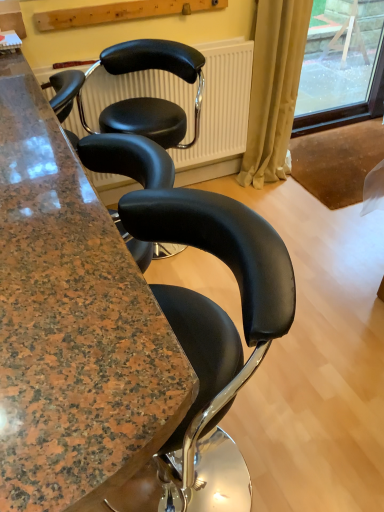
What do you see at coordinates (138, 97) in the screenshot? I see `black leather chair at center` at bounding box center [138, 97].

Locate an element on the screen. This screenshot has height=512, width=384. black leather chair at center is located at coordinates (x=138, y=97).

The height and width of the screenshot is (512, 384). In order to click on granite countertop at center in this screenshot , I will do `click(72, 325)`.

In order to face granite countertop at center, should I rotate leftwards or rightwards?

A 21.660 degree turn to the left will do.

The image size is (384, 512). I want to click on beige fabric curtain at right, so click(x=274, y=88).

Locate an element on the screen. This screenshot has width=384, height=512. transparent glass window at upper right is located at coordinates (339, 54).

Is black leather chair at center directly adjacent to granite countertop at center?

black leather chair at center and granite countertop at center are clearly separated.

Consider the image. Does black leather chair at center have a lesser height compared to granite countertop at center?

Yes, black leather chair at center is shorter than granite countertop at center.

Which is more to the left, black leather chair at center or granite countertop at center?

granite countertop at center.

Is black leather chair at center positioned in front of granite countertop at center?

No.

Is transparent glass window at upper right positioned in front of beige fabric curtain at right?

No, transparent glass window at upper right is behind beige fabric curtain at right.

From the picture: Is there a large distance between transparent glass window at upper right and beige fabric curtain at right?

That's not correct — transparent glass window at upper right is a little close to beige fabric curtain at right.

How distant is transparent glass window at upper right from beige fabric curtain at right?

transparent glass window at upper right and beige fabric curtain at right are 89.48 centimeters apart from each other.

Between point (341, 85) and point (295, 81), which one is positioned in front?

The point (295, 81) is in front.

How many degrees apart are the facing directions of granite countertop at center and black leather chair at center?

The angle between the facing direction of granite countertop at center and the facing direction of black leather chair at center is 0.332 degrees.

Is granite countertop at center taller than black leather chair at center?

Correct, granite countertop at center is much taller as black leather chair at center.

Considering the sizes of granite countertop at center and black leather chair at center in the image, is granite countertop at center bigger or smaller than black leather chair at center?

Result: granite countertop at center is bigger than black leather chair at center.

Is transparent glass window at upper right wider than black leather chair at center?

No, transparent glass window at upper right is not wider than black leather chair at center.

Does point (360, 90) appear closer or farther from the camera than point (189, 61)?

Point (360, 90) appears to be farther away from the viewer than point (189, 61).

Is transparent glass window at upper right inside the boundaries of black leather chair at center, or outside?

transparent glass window at upper right exists outside the volume of black leather chair at center.

Where is `window screen behind the black leather chair at center`? window screen behind the black leather chair at center is located at coordinates (339, 54).

Which is more to the right, granite countertop at center or transparent glass window at upper right?

transparent glass window at upper right is more to the right.

What are the coordinates of `cabinetry that is under the transparent glass window at upper right (from a real-world perspective)` in the screenshot? It's located at (72, 325).

Considering the sizes of objects granite countertop at center and transparent glass window at upper right in the image provided, who is thinner, granite countertop at center or transparent glass window at upper right?

transparent glass window at upper right.

Measure the distance from granite countertop at center to transparent glass window at upper right.

granite countertop at center and transparent glass window at upper right are 8.10 feet apart.

Would you consider granite countertop at center to be distant from beige fabric curtain at right?

granite countertop at center is far away from beige fabric curtain at right.

Does point (119, 277) come closer to viewer compared to point (290, 12)?

Yes, it is in front of point (290, 12).

Can you confirm if granite countertop at center is positioned to the left of beige fabric curtain at right?

Indeed, granite countertop at center is positioned on the left side of beige fabric curtain at right.

From the image's perspective, is granite countertop at center beneath beige fabric curtain at right?

Yes, from the image's perspective, granite countertop at center is below beige fabric curtain at right.

Looking at this image, visually, is beige fabric curtain at right positioned to the left or to the right of black leather chair at center?

From the image, it's evident that beige fabric curtain at right is to the right of black leather chair at center.

Can you confirm if beige fabric curtain at right is shorter than black leather chair at center?

No.

How many degrees apart are the facing directions of beige fabric curtain at right and black leather chair at center?

beige fabric curtain at right and black leather chair at center are facing 91.2 degrees away from each other.

Which of these two, beige fabric curtain at right or black leather chair at center, is smaller?

beige fabric curtain at right.

I want to click on cabinetry below the black leather chair at center (from the image's perspective), so click(72, 325).

Identify the location of curtain lying in front of the transparent glass window at upper right. (274, 88).

Considering their positions, is transparent glass window at upper right positioned closer to beige fabric curtain at right than granite countertop at center?

Among the two, transparent glass window at upper right is located nearer to beige fabric curtain at right.

When comparing their distances from beige fabric curtain at right, does black leather chair at center or granite countertop at center seem closer?

The object closer to beige fabric curtain at right is black leather chair at center.

Estimate the real-world distances between objects in this image. Which object is closer to transparent glass window at upper right, granite countertop at center or beige fabric curtain at right?

beige fabric curtain at right is positioned closer to the anchor transparent glass window at upper right.

Based on their spatial positions, is beige fabric curtain at right or black leather chair at center closer to granite countertop at center?

Among the two, black leather chair at center is located nearer to granite countertop at center.

When comparing their distances from granite countertop at center, does transparent glass window at upper right or black leather chair at center seem closer?

Based on the image, black leather chair at center appears to be nearer to granite countertop at center.

Looking at the image, which one is located further to black leather chair at center, granite countertop at center or transparent glass window at upper right?

Based on the image, transparent glass window at upper right appears to be further to black leather chair at center.

Based on their spatial positions, is granite countertop at center or transparent glass window at upper right closer to beige fabric curtain at right?

Among the two, transparent glass window at upper right is located nearer to beige fabric curtain at right.

Which object lies further to the anchor point transparent glass window at upper right, beige fabric curtain at right or black leather chair at center?

The object further to transparent glass window at upper right is black leather chair at center.

Where is `chair between granite countertop at center and transparent glass window at upper right from front to back`? chair between granite countertop at center and transparent glass window at upper right from front to back is located at coordinates (138, 97).

Image resolution: width=384 pixels, height=512 pixels. I want to click on curtain positioned between granite countertop at center and transparent glass window at upper right from near to far, so click(x=274, y=88).

Locate an element on the screen. The height and width of the screenshot is (512, 384). curtain located between black leather chair at center and transparent glass window at upper right in the left-right direction is located at coordinates (274, 88).

Identify the location of chair between granite countertop at center and beige fabric curtain at right along the z-axis. (138, 97).